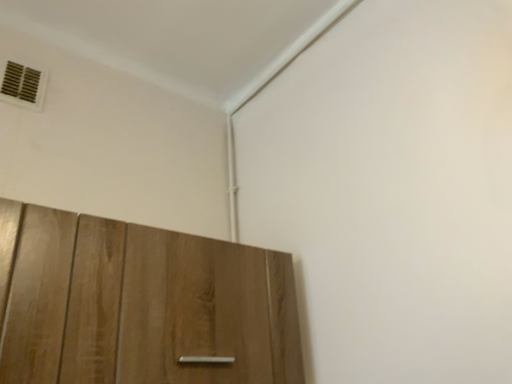
Question: Looking at their shapes, would you say wooden cabinet at lower left is wider or thinner than metallic vent at upper left?

Choices:
 (A) thin
 (B) wide

Answer: (B)

Question: Is wooden cabinet at lower left bigger or smaller than metallic vent at upper left?

Choices:
 (A) small
 (B) big

Answer: (B)

Question: From the image's perspective, relative to metallic vent at upper left, is wooden cabinet at lower left above or below?

Choices:
 (A) above
 (B) below

Answer: (B)

Question: Considering the relative positions of metallic vent at upper left and wooden cabinet at lower left in the image provided, is metallic vent at upper left to the left or to the right of wooden cabinet at lower left?

Choices:
 (A) left
 (B) right

Answer: (A)

Question: From a real-world perspective, relative to wooden cabinet at lower left, is metallic vent at upper left vertically above or below?

Choices:
 (A) above
 (B) below

Answer: (A)

Question: Considering their positions, is metallic vent at upper left located in front of or behind wooden cabinet at lower left?

Choices:
 (A) behind
 (B) front

Answer: (A)

Question: In terms of height, does metallic vent at upper left look taller or shorter compared to wooden cabinet at lower left?

Choices:
 (A) short
 (B) tall

Answer: (A)